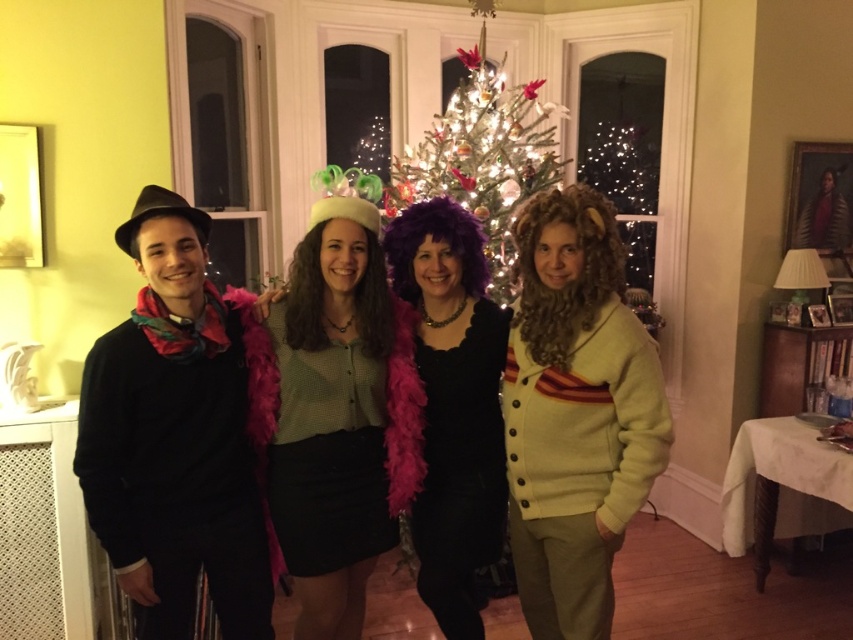
Does point (668, 451) come closer to viewer compared to point (496, 308)?

That is True.

Does light yellow cardigan at right have a smaller size compared to purple feather boa at center?

No, light yellow cardigan at right is not smaller than purple feather boa at center.

Describe the element at coordinates (575, 413) in the screenshot. I see `light yellow cardigan at right` at that location.

Where is `light yellow cardigan at right`? light yellow cardigan at right is located at coordinates (575, 413).

Can you confirm if black matte sweater at left is positioned below purple feather boa at center?

Actually, black matte sweater at left is above purple feather boa at center.

Consider the image. Who is more forward, (x=234, y=598) or (x=469, y=429)?

Point (x=234, y=598) is in front.

Is point (186, 497) positioned before point (451, 436)?

Yes, it is.

Find the location of a particular element. The height and width of the screenshot is (640, 853). black matte sweater at left is located at coordinates (175, 436).

Is matte green blouse at center positioned in front of shiny silver christmas tree at center?

Yes.

Who is taller, matte green blouse at center or shiny silver christmas tree at center?

Answer: shiny silver christmas tree at center

Find the location of a particular element. Image resolution: width=853 pixels, height=640 pixels. matte green blouse at center is located at coordinates (340, 416).

At what (x,y) coordinates should I click in order to perform the action: click on matte green blouse at center. Please return your answer as a coordinate pair (x, y). Looking at the image, I should click on (340, 416).